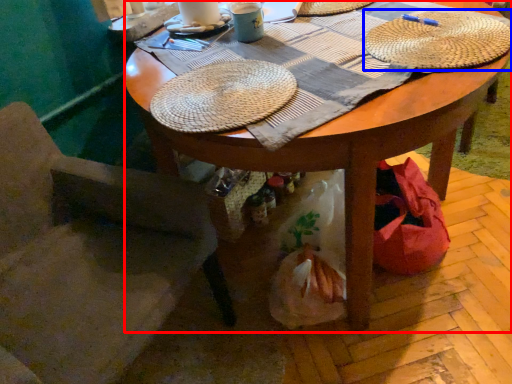
Question: Among these objects, which one is farthest to the camera, desk (highlighted by a red box) or hat (highlighted by a blue box)?

Choices:
 (A) desk
 (B) hat

Answer: (B)